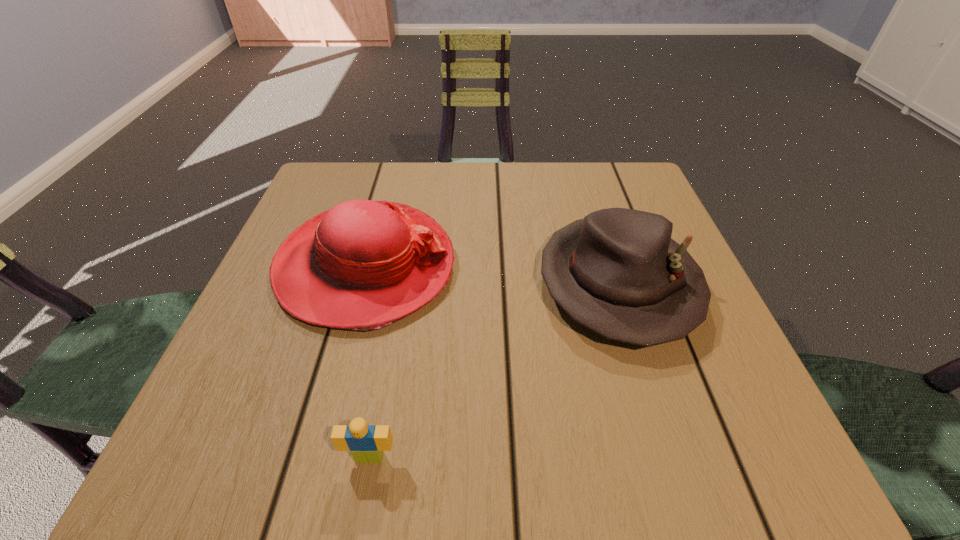
Image resolution: width=960 pixels, height=540 pixels. I want to click on the left hat, so pyautogui.click(x=362, y=265).

Find the location of a particular element. the rightmost object is located at coordinates (618, 272).

At what (x,y) coordinates should I click in order to perform the action: click on Lego. Please return your answer as a coordinate pair (x, y). The image size is (960, 540). Looking at the image, I should click on (366, 443).

Where is `the nearest object`? The width and height of the screenshot is (960, 540). the nearest object is located at coordinates (366, 443).

Locate an element on the screen. The image size is (960, 540). vacant region located at the front of the left hat with a bow is located at coordinates point(540,266).

The height and width of the screenshot is (540, 960). In order to click on free region located 0.120m on the decorative side of the right hat in this screenshot , I will do `click(665, 432)`.

You are a GUI agent. You are given a task and a screenshot of the screen. Output one action in this format:
    pyautogui.click(x=<x>, y=<y>)
    Task: Click on the object that is positioned at the far edge
    Image resolution: width=960 pixels, height=540 pixels.
    Given the screenshot: What is the action you would take?
    pyautogui.click(x=362, y=265)

At what (x,y) coordinates should I click in order to perform the action: click on object positioned at the near edge. Please return your answer as a coordinate pair (x, y). Image resolution: width=960 pixels, height=540 pixels. Looking at the image, I should click on (366, 443).

The height and width of the screenshot is (540, 960). Identify the location of object that is at the left edge. (362, 265).

The image size is (960, 540). Find the location of `object that is at the right edge`. object that is at the right edge is located at coordinates (618, 272).